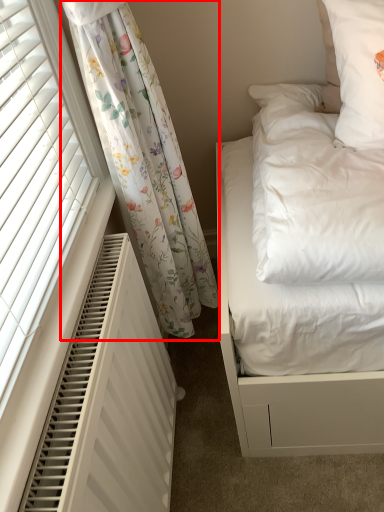
Question: Where is curtain (annotated by the red box) located in relation to air conditioner in the image?

Choices:
 (A) left
 (B) right

Answer: (B)